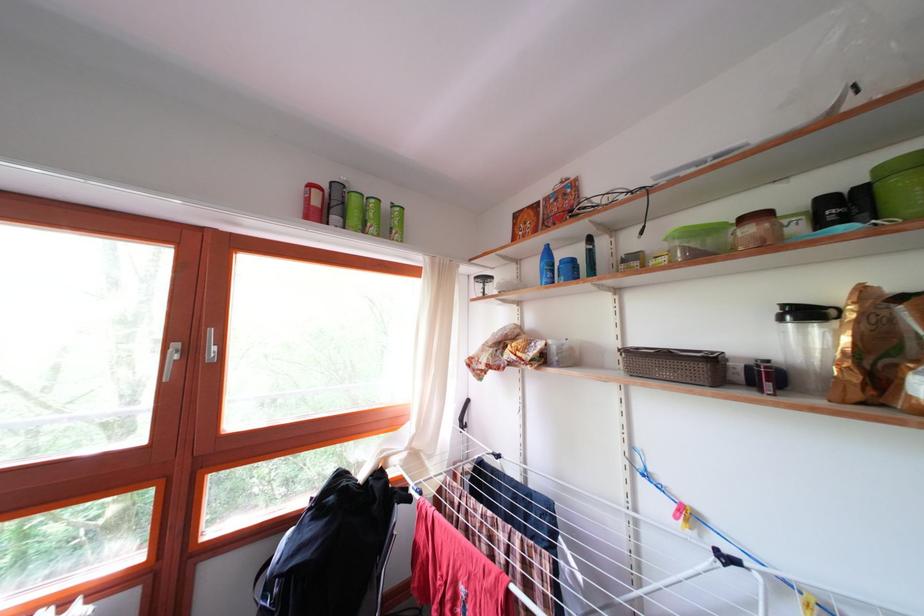
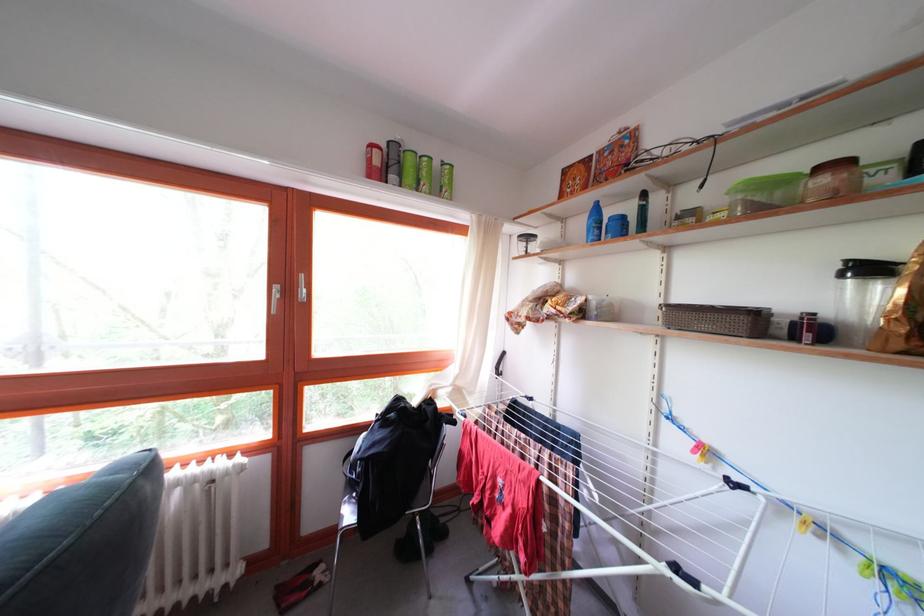
The point at [402,212] is marked in the first image. Where is the corresponding point in the second image?

(452, 169)